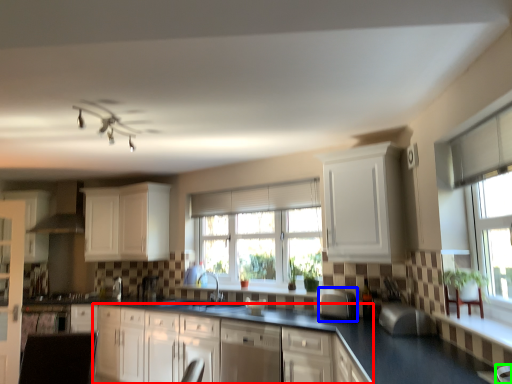
Question: Estimate the real-world distances between objects in this image. Which object is closer to cabinetry (highlighted by a red box), appliance (highlighted by a blue box) or armchair (highlighted by a green box)?

Choices:
 (A) appliance
 (B) armchair

Answer: (A)